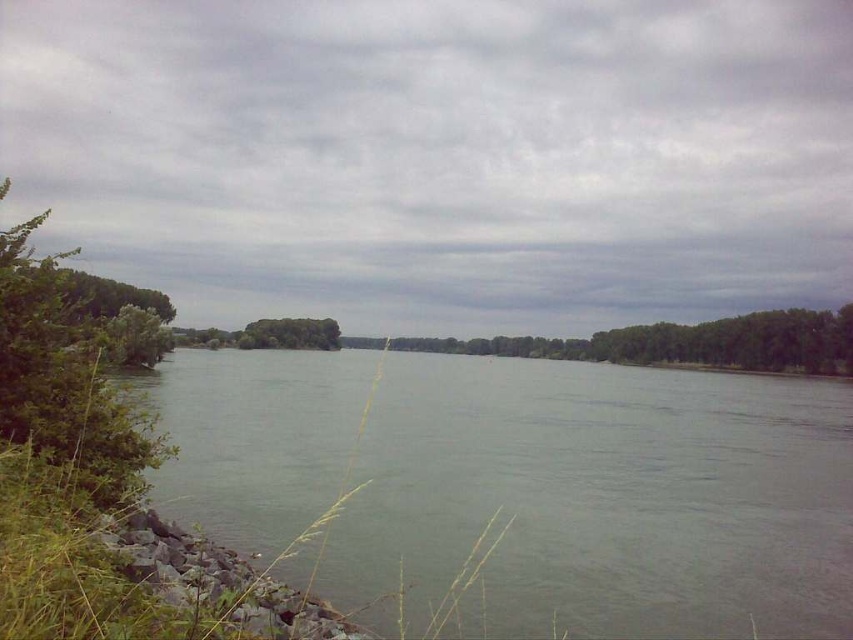
You are standing on the riverside and want to take a photo of the gray water at center and the green leafy shrub at left. Which object should you focus on first to ensure both are in sharp focus?

You should focus on the green leafy shrub at left first because it is farther away from the viewer compared to the gray water at center, so adjusting focus starting from the farther object ensures both can be in focus.

You are standing on the riverbank and notice the green leafy shrub at left and the green leafy trees at center. Which one is positioned higher up relative to the river?

The green leafy shrub at left is located above the green leafy trees at center, so it is positioned higher up relative to the river.